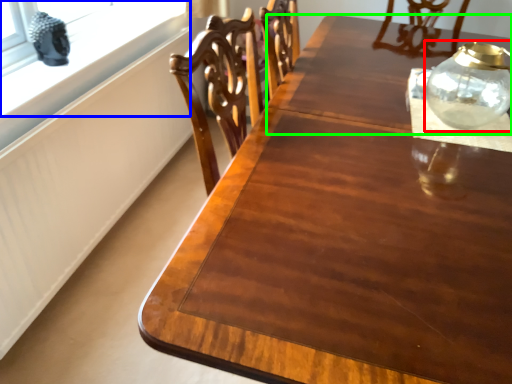
Question: Which object is the closest to the glass vase (highlighted by a red box)? Choose among these: window (highlighted by a blue box) or round table (highlighted by a green box).

Choices:
 (A) window
 (B) round table

Answer: (B)